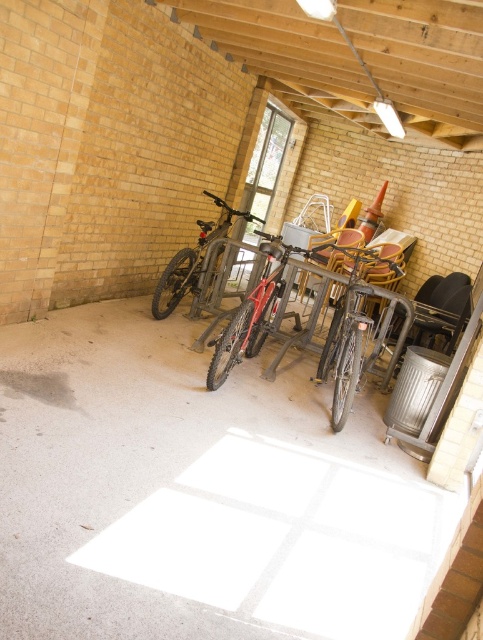
Where is `white concrete floor at center`? white concrete floor at center is located at coordinates (198, 493).

Is white concrete floor at center shorter than shiny red bicycle at center?

Yes.

Which is behind, point (417, 544) or point (240, 321)?

The point (240, 321) is more distant.

In order to click on white concrete floor at center in this screenshot , I will do `click(198, 493)`.

Which is more to the right, shiny metallic bicycle at center or shiny silver bicycle at center?

Positioned to the right is shiny metallic bicycle at center.

Does shiny metallic bicycle at center have a larger size compared to shiny silver bicycle at center?

Yes, shiny metallic bicycle at center is bigger than shiny silver bicycle at center.

Locate an element on the screen. The width and height of the screenshot is (483, 640). shiny metallic bicycle at center is located at coordinates (350, 333).

Identify the location of shiny metallic bicycle at center. (350, 333).

Can you confirm if shiny metallic bicycle at center is smaller than shiny red bicycle at center?

No, shiny metallic bicycle at center is not smaller than shiny red bicycle at center.

Does shiny metallic bicycle at center have a lesser width compared to shiny red bicycle at center?

In fact, shiny metallic bicycle at center might be wider than shiny red bicycle at center.

Where is `shiny metallic bicycle at center`? This screenshot has width=483, height=640. shiny metallic bicycle at center is located at coordinates (350, 333).